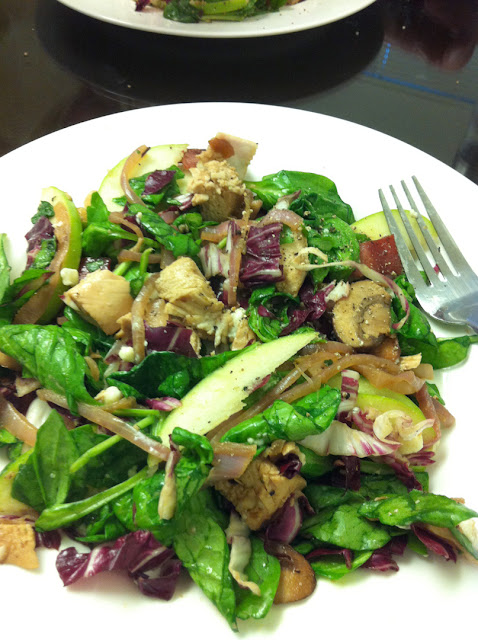
This screenshot has height=640, width=478. I want to click on white plate, so click(325, 130).